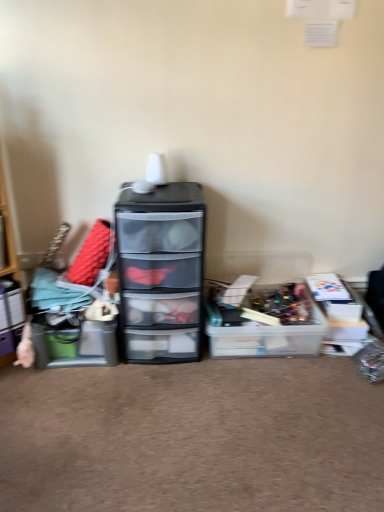
Image resolution: width=384 pixels, height=512 pixels. What do you see at coordinates (269, 325) in the screenshot?
I see `translucent plastic storage box at center, positioned as the third storage box in left-to-right order` at bounding box center [269, 325].

The height and width of the screenshot is (512, 384). I want to click on matte plastic storage box at left, the third storage box viewed from the right, so click(x=10, y=315).

Measure the distance between matte plastic storage box at left, the third storage box viewed from the right, and camera.

The distance of matte plastic storage box at left, the third storage box viewed from the right, from camera is 5.99 feet.

The width and height of the screenshot is (384, 512). Find the location of `transparent plastic chest of drawers at center`. transparent plastic chest of drawers at center is located at coordinates (161, 272).

You are a GUI agent. You are given a task and a screenshot of the screen. Output one action in this format:
    pyautogui.click(x=<x>, y=<y>)
    Task: Click on the wooden shelf at left
    The image size is (384, 512).
    Given the screenshot: What is the action you would take?
    pyautogui.click(x=8, y=232)

This screenshot has width=384, height=512. In order to click on translucent plastic storage box at center, positioned as the third storage box in left-to-right order in this screenshot , I will do `click(269, 325)`.

Is translucent plastic storage box at center, which is the 1th storage box in right-to-left order, oriented away from matte plastic storage box at left, the 2th storage box positioned from the right?

No, translucent plastic storage box at center, which is the 1th storage box in right-to-left order, is not facing the opposite direction of matte plastic storage box at left, the 2th storage box positioned from the right.

Is translucent plastic storage box at center, which is the 1th storage box in right-to-left order, with matte plastic storage box at left, the 2th storage box positioned from the right?

translucent plastic storage box at center, which is the 1th storage box in right-to-left order, is not next to matte plastic storage box at left, the 2th storage box positioned from the right, and they're not touching.

From a real-world perspective, which is physically above, translucent plastic storage box at center, which is the 1th storage box in right-to-left order, or matte plastic storage box at left, the 2th storage box positioned from the right?

In real-world perspective, matte plastic storage box at left, the 2th storage box positioned from the right, is above.

In the scene shown: Considering the sizes of objects translucent plastic storage box at center, which is the 1th storage box in right-to-left order, and matte plastic storage box at left, the 2th storage box positioned from the left, in the image provided, who is taller, translucent plastic storage box at center, which is the 1th storage box in right-to-left order, or matte plastic storage box at left, the 2th storage box positioned from the left,?

matte plastic storage box at left, the 2th storage box positioned from the left.

Consider the image. Is wooden shelf at left surrounded by translucent plastic storage box at center, positioned as the third storage box in left-to-right order?

Actually, wooden shelf at left is outside translucent plastic storage box at center, positioned as the third storage box in left-to-right order.

Looking at their sizes, would you say translucent plastic storage box at center, positioned as the third storage box in left-to-right order, is wider or thinner than wooden shelf at left?

Clearly, translucent plastic storage box at center, positioned as the third storage box in left-to-right order, has more width compared to wooden shelf at left.

Can you tell me how much translucent plastic storage box at center, which is the 1th storage box in right-to-left order, and wooden shelf at left differ in facing direction?

They differ by 42.7 degrees in their facing directions.

Is translucent plastic storage box at center, positioned as the third storage box in left-to-right order, behind wooden shelf at left?

Yes, it is.

Considering the sizes of objects matte plastic storage box at left, the 2th storage box positioned from the right, and transparent plastic chest of drawers at center in the image provided, who is taller, matte plastic storage box at left, the 2th storage box positioned from the right, or transparent plastic chest of drawers at center?

With more height is transparent plastic chest of drawers at center.

Is matte plastic storage box at left, the 2th storage box positioned from the left, not near transparent plastic chest of drawers at center?

No, matte plastic storage box at left, the 2th storage box positioned from the left, is in close proximity to transparent plastic chest of drawers at center.

Considering their positions, is matte plastic storage box at left, the 2th storage box positioned from the right, located in front of or behind transparent plastic chest of drawers at center?

Visually, matte plastic storage box at left, the 2th storage box positioned from the right, is located behind transparent plastic chest of drawers at center.

Would you say matte plastic storage box at left, the 2th storage box positioned from the right, is inside or outside transparent plastic chest of drawers at center?

matte plastic storage box at left, the 2th storage box positioned from the right, is not enclosed by transparent plastic chest of drawers at center.

Relative to translucent plastic storage box at center, positioned as the third storage box in left-to-right order, is matte plastic storage box at left, which is the 1th storage box from left to right, in front or behind?

matte plastic storage box at left, which is the 1th storage box from left to right, is positioned closer to the viewer than translucent plastic storage box at center, positioned as the third storage box in left-to-right order.

Considering the relative positions of matte plastic storage box at left, which is the 1th storage box from left to right, and translucent plastic storage box at center, which is the 1th storage box in right-to-left order, in the image provided, is matte plastic storage box at left, which is the 1th storage box from left to right, to the left or to the right of translucent plastic storage box at center, which is the 1th storage box in right-to-left order,?

matte plastic storage box at left, which is the 1th storage box from left to right, is to the left of translucent plastic storage box at center, which is the 1th storage box in right-to-left order.

In the scene shown: Can you tell me how much matte plastic storage box at left, the third storage box viewed from the right, and translucent plastic storage box at center, which is the 1th storage box in right-to-left order, differ in facing direction?

matte plastic storage box at left, the third storage box viewed from the right, and translucent plastic storage box at center, which is the 1th storage box in right-to-left order, are facing 45.1 degrees away from each other.

Between matte plastic storage box at left, which is the 1th storage box from left to right, and translucent plastic storage box at center, which is the 1th storage box in right-to-left order, which one has smaller width?

matte plastic storage box at left, which is the 1th storage box from left to right, is thinner.

From a real-world perspective, is matte plastic storage box at left, the 2th storage box positioned from the right, beneath translucent plastic storage box at center, which is the 1th storage box in right-to-left order?

No, from a real-world perspective, matte plastic storage box at left, the 2th storage box positioned from the right, is not under translucent plastic storage box at center, which is the 1th storage box in right-to-left order.

Is the depth of matte plastic storage box at left, the 2th storage box positioned from the right, less than that of translucent plastic storage box at center, positioned as the third storage box in left-to-right order?

That is True.

From the picture: Is matte plastic storage box at left, the 2th storage box positioned from the right, bigger or smaller than translucent plastic storage box at center, which is the 1th storage box in right-to-left order?

Clearly, matte plastic storage box at left, the 2th storage box positioned from the right, is smaller in size than translucent plastic storage box at center, which is the 1th storage box in right-to-left order.

Consider the image. Considering the sizes of objects matte plastic storage box at left, the 2th storage box positioned from the right, and translucent plastic storage box at center, which is the 1th storage box in right-to-left order, in the image provided, who is shorter, matte plastic storage box at left, the 2th storage box positioned from the right, or translucent plastic storage box at center, which is the 1th storage box in right-to-left order,?

translucent plastic storage box at center, which is the 1th storage box in right-to-left order.

Is transparent plastic chest of drawers at center positioned far away from matte plastic storage box at left, the 2th storage box positioned from the left?

transparent plastic chest of drawers at center is actually quite close to matte plastic storage box at left, the 2th storage box positioned from the left.

From the image's perspective, is transparent plastic chest of drawers at center above or below matte plastic storage box at left, the 2th storage box positioned from the left?

From the image's perspective, transparent plastic chest of drawers at center appears above matte plastic storage box at left, the 2th storage box positioned from the left.

Is point (126, 322) closer or farther from the camera than point (80, 335)?

Point (126, 322).

Considering the relative positions of transparent plastic chest of drawers at center and matte plastic storage box at left, the 2th storage box positioned from the left, in the image provided, is transparent plastic chest of drawers at center in front of matte plastic storage box at left, the 2th storage box positioned from the left,?

Yes, it is in front of matte plastic storage box at left, the 2th storage box positioned from the left.

In the scene shown: Which object is positioned more to the right, translucent plastic storage box at center, which is the 1th storage box in right-to-left order, or transparent plastic chest of drawers at center?

translucent plastic storage box at center, which is the 1th storage box in right-to-left order.

Looking at this image, what's the angular difference between translucent plastic storage box at center, which is the 1th storage box in right-to-left order, and transparent plastic chest of drawers at center's facing directions?

0.773 degrees.

From the image's perspective, relative to transparent plastic chest of drawers at center, is translucent plastic storage box at center, positioned as the third storage box in left-to-right order, above or below?

Based on their image positions, translucent plastic storage box at center, positioned as the third storage box in left-to-right order, is located beneath transparent plastic chest of drawers at center.

Is translucent plastic storage box at center, positioned as the third storage box in left-to-right order, spatially inside transparent plastic chest of drawers at center, or outside of it?

The correct answer is: outside.

I want to click on storage box lying below the translucent plastic storage box at center, which is the 1th storage box in right-to-left order (from the image's perspective), so click(x=75, y=345).

Locate an element on the screen. The width and height of the screenshot is (384, 512). shelf that appears above the translucent plastic storage box at center, which is the 1th storage box in right-to-left order (from a real-world perspective) is located at coordinates (8, 232).

From the image, which object appears to be nearer to matte plastic storage box at left, which is the 1th storage box from left to right, translucent plastic storage box at center, positioned as the third storage box in left-to-right order, or transparent plastic chest of drawers at center?

Based on the image, transparent plastic chest of drawers at center appears to be nearer to matte plastic storage box at left, which is the 1th storage box from left to right.

Consider the image. Which object lies further to the anchor point translucent plastic storage box at center, which is the 1th storage box in right-to-left order, matte plastic storage box at left, the 2th storage box positioned from the right, or matte plastic storage box at left, which is the 1th storage box from left to right?

Based on the image, matte plastic storage box at left, which is the 1th storage box from left to right, appears to be further to translucent plastic storage box at center, which is the 1th storage box in right-to-left order.

From the image, which object appears to be nearer to matte plastic storage box at left, the 2th storage box positioned from the left, wooden shelf at left or transparent plastic chest of drawers at center?

Among the two, transparent plastic chest of drawers at center is located nearer to matte plastic storage box at left, the 2th storage box positioned from the left.

When comparing their distances from wooden shelf at left, does matte plastic storage box at left, the 2th storage box positioned from the left, or transparent plastic chest of drawers at center seem further?

transparent plastic chest of drawers at center lies further to wooden shelf at left than the other object.

Considering their positions, is matte plastic storage box at left, the 2th storage box positioned from the right, positioned further to transparent plastic chest of drawers at center than wooden shelf at left?

wooden shelf at left lies further to transparent plastic chest of drawers at center than the other object.

From the image, which object appears to be nearer to transparent plastic chest of drawers at center, matte plastic storage box at left, which is the 1th storage box from left to right, or matte plastic storage box at left, the 2th storage box positioned from the right?

The object closer to transparent plastic chest of drawers at center is matte plastic storage box at left, the 2th storage box positioned from the right.

When comparing their distances from wooden shelf at left, does matte plastic storage box at left, the 2th storage box positioned from the right, or matte plastic storage box at left, the third storage box viewed from the right, seem further?

The object further to wooden shelf at left is matte plastic storage box at left, the 2th storage box positioned from the right.

Which object lies further to the anchor point transparent plastic chest of drawers at center, wooden shelf at left or translucent plastic storage box at center, which is the 1th storage box in right-to-left order?

wooden shelf at left is further to transparent plastic chest of drawers at center.

Where is `chest of drawers between wooden shelf at left and translucent plastic storage box at center, which is the 1th storage box in right-to-left order, in the horizontal direction`? This screenshot has height=512, width=384. chest of drawers between wooden shelf at left and translucent plastic storage box at center, which is the 1th storage box in right-to-left order, in the horizontal direction is located at coordinates (161, 272).

You are a GUI agent. You are given a task and a screenshot of the screen. Output one action in this format:
    pyautogui.click(x=<x>, y=<y>)
    Task: Click on the storage box positioned between wooden shelf at left and matte plastic storage box at left, the 2th storage box positioned from the right, from near to far
    Image resolution: width=384 pixels, height=512 pixels.
    Given the screenshot: What is the action you would take?
    pyautogui.click(x=10, y=315)

You are a GUI agent. You are given a task and a screenshot of the screen. Output one action in this format:
    pyautogui.click(x=<x>, y=<y>)
    Task: Click on the storage box situated between matte plastic storage box at left, which is the 1th storage box from left to right, and translucent plastic storage box at center, positioned as the third storage box in left-to-right order, from left to right
    
    Given the screenshot: What is the action you would take?
    pyautogui.click(x=75, y=345)

The height and width of the screenshot is (512, 384). I want to click on storage box between matte plastic storage box at left, which is the 1th storage box from left to right, and transparent plastic chest of drawers at center, in the horizontal direction, so click(x=75, y=345).